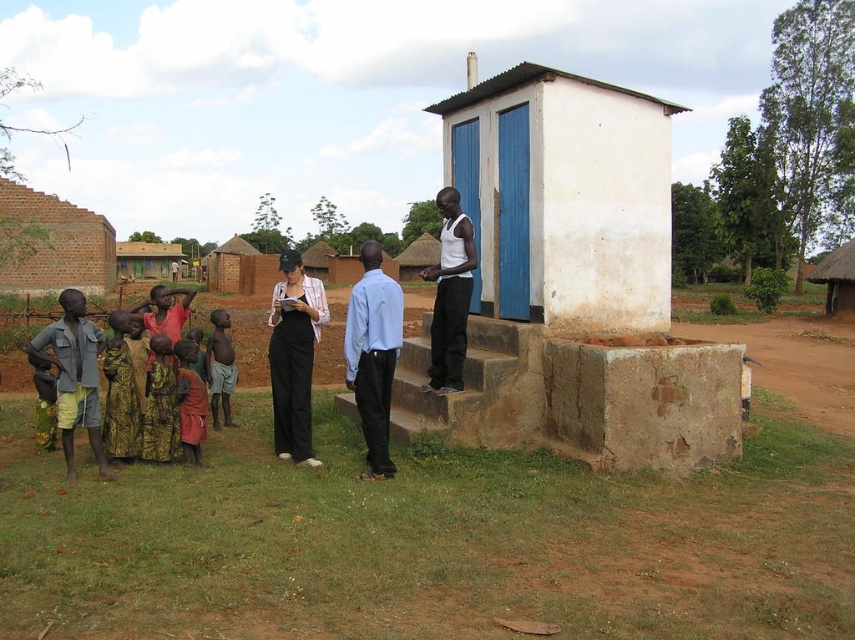
You are a visitor to this rural area and want to take a photo of both the light blue shirt at center and the thatched roof hut at upper right. Which object should you focus on first to ensure both are in the frame?

You should focus on the light blue shirt at center first because it is closer to you than the thatched roof hut at upper right, so adjusting the camera to include both would require starting with the closer object.

You are standing at point (835, 272) and want to move to point (364, 426). Is the path between these two points clear of any obstacles?

Yes, the path between point (364, 426) and point (835, 272) is clear because point (364, 426) is in front of point (835, 272), indicating no obstruction between them.

You are a surveyor standing in the rural area shown. You need to determine if the brown dirt field at lower left is higher or lower than the white matte tank top at upper center. Based on the scene, what can you conclude?

The brown dirt field at lower left has a lesser height compared to the white matte tank top at upper center, so it is lower.